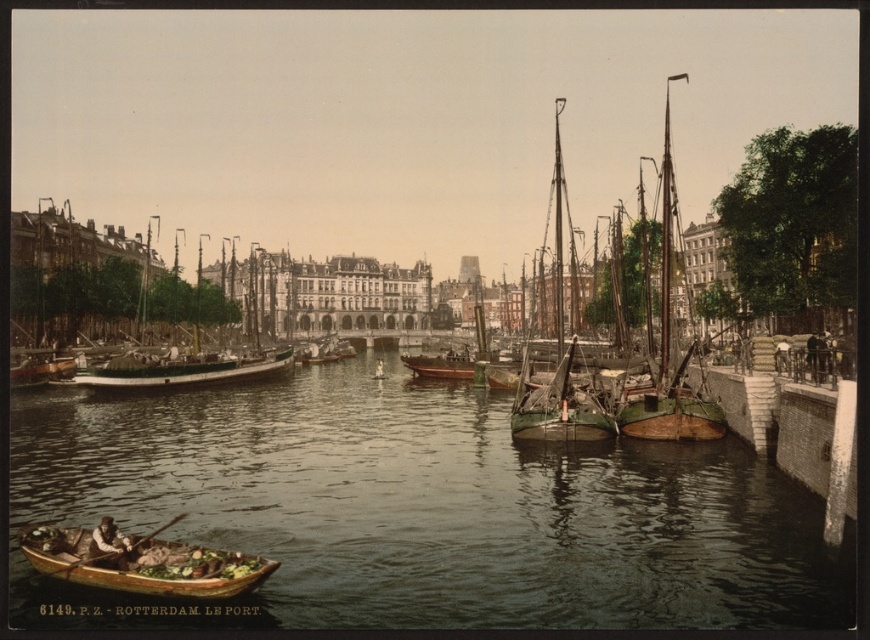
Does wooden sailboat at right have a greater height compared to wooden boat at left?

Yes.

Is wooden sailboat at right above wooden boat at left?

Yes.

I want to click on wooden sailboat at right, so click(x=668, y=346).

Find the location of a particular element. The image size is (870, 640). wooden sailboat at right is located at coordinates (668, 346).

Which of these two, green matte sailboat at center or wooden boat at left, stands shorter?

wooden boat at left

Is green matte sailboat at center wider than wooden boat at left?

In fact, green matte sailboat at center might be narrower than wooden boat at left.

Image resolution: width=870 pixels, height=640 pixels. I want to click on green matte sailboat at center, so click(559, 358).

You are a GUI agent. You are given a task and a screenshot of the screen. Output one action in this format:
    pyautogui.click(x=<x>, y=<y>)
    Task: Click on the green matte sailboat at center
    The image size is (870, 640).
    Given the screenshot: What is the action you would take?
    pyautogui.click(x=559, y=358)

Which is more to the left, greenish water at center or wooden canoe at lower left?

Positioned to the left is wooden canoe at lower left.

Can you confirm if greenish water at center is shorter than wooden canoe at lower left?

Incorrect, greenish water at center's height does not fall short of wooden canoe at lower left's.

Identify the location of greenish water at center. The width and height of the screenshot is (870, 640). pos(418,512).

You are a GUI agent. You are given a task and a screenshot of the screen. Output one action in this format:
    pyautogui.click(x=<x>, y=<y>)
    Task: Click on the greenish water at center
    
    Given the screenshot: What is the action you would take?
    pyautogui.click(x=418, y=512)